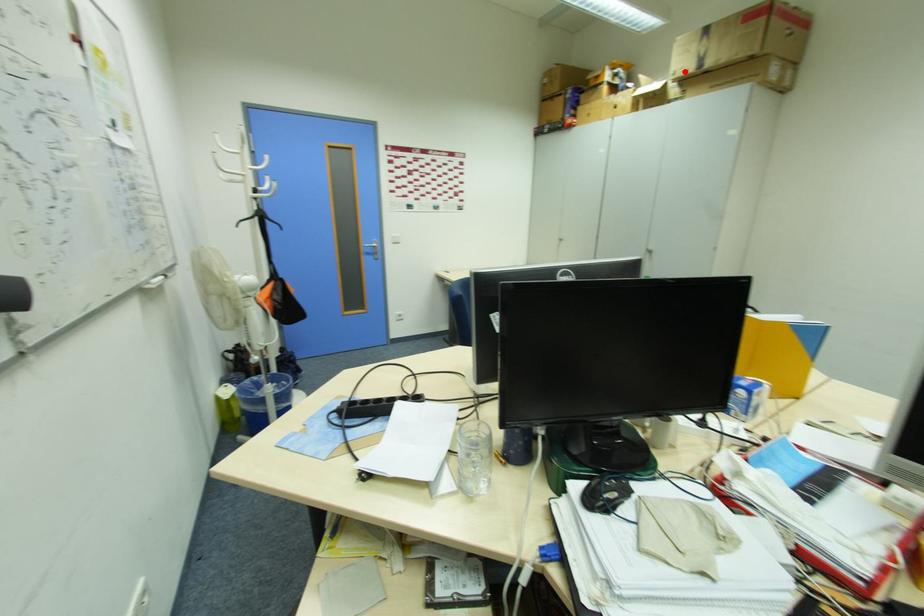
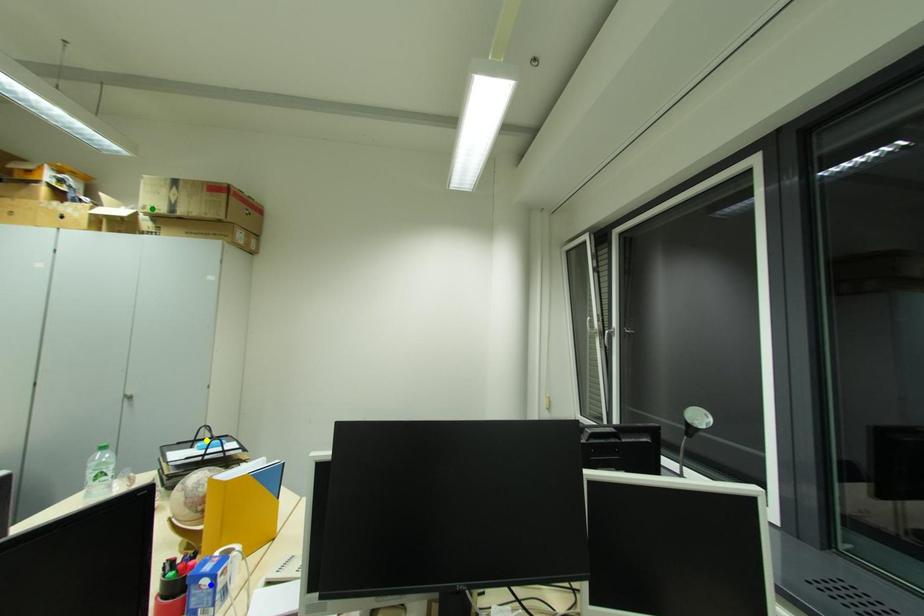
Question: I am providing you with two images of the same scene from different viewpoints. A red point is marked on the first image. You are given multiple points on the second image. Which point in image 2 is actually the same real-world point as the red point in image 1?

Choices:
 (A) blue point
 (B) green point
 (C) yellow point

Answer: (B)